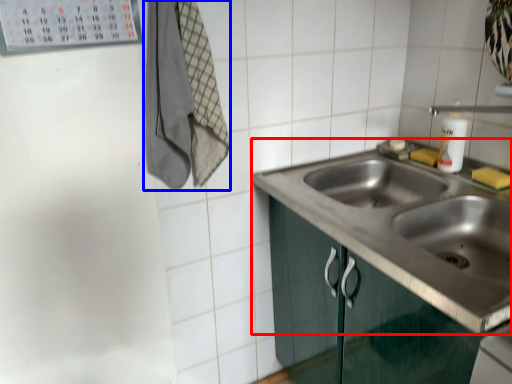
Question: Which object is closer to the camera taking this photo, sink (highlighted by a red box) or laundry (highlighted by a blue box)?

Choices:
 (A) sink
 (B) laundry

Answer: (A)